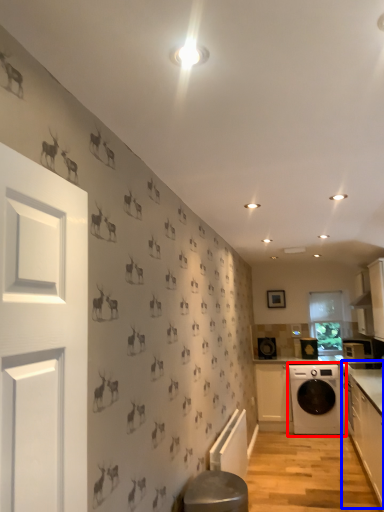
Question: Which of the following is the farthest to the observer, washing machine (highlighted by a red box) or cabinetry (highlighted by a blue box)?

Choices:
 (A) washing machine
 (B) cabinetry

Answer: (A)